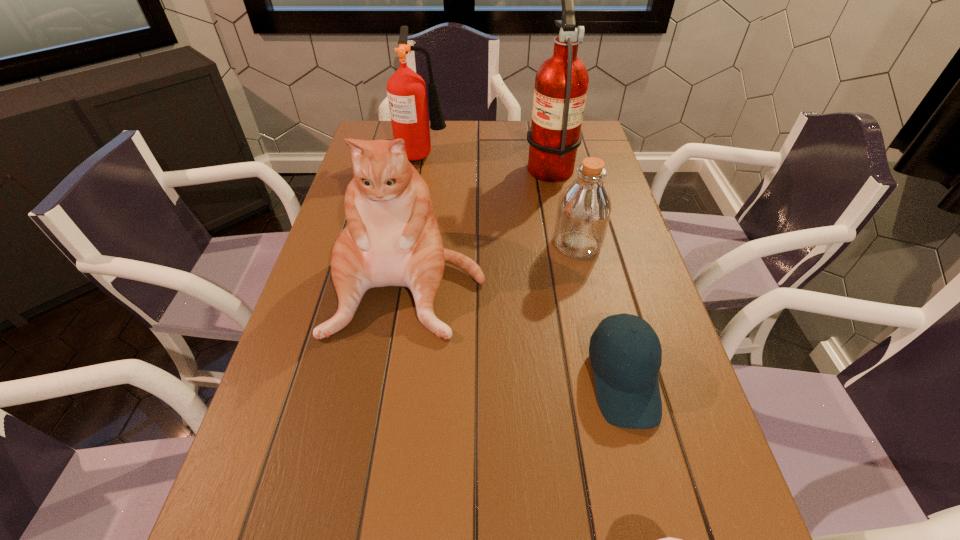
At what (x,y) coordinates should I click in order to perform the action: click on the taller fire extinguisher. Please return your answer as a coordinate pair (x, y). This screenshot has width=960, height=540. Looking at the image, I should click on (561, 83).

Identify the location of the tallest object. This screenshot has width=960, height=540. (561, 83).

Where is `the left fire extinguisher`? The height and width of the screenshot is (540, 960). the left fire extinguisher is located at coordinates (406, 90).

I want to click on cat, so click(x=392, y=238).

The width and height of the screenshot is (960, 540). I want to click on the third shortest object, so click(x=584, y=208).

The image size is (960, 540). In order to click on baseball cap in this screenshot , I will do `click(627, 387)`.

Identify the location of vacant area situated 0.250m on the nozzle and handle of the taller fire extinguisher. click(445, 164).

Locate an element on the screen. The image size is (960, 540). free space located 0.100m on the nozzle and handle of the taller fire extinguisher is located at coordinates (492, 164).

Where is `vacant space located on the nozzle and handle of the taller fire extinguisher`? vacant space located on the nozzle and handle of the taller fire extinguisher is located at coordinates (398, 164).

Locate an element on the screen. free space located 0.250m at the nozzle of the shorter fire extinguisher is located at coordinates (524, 153).